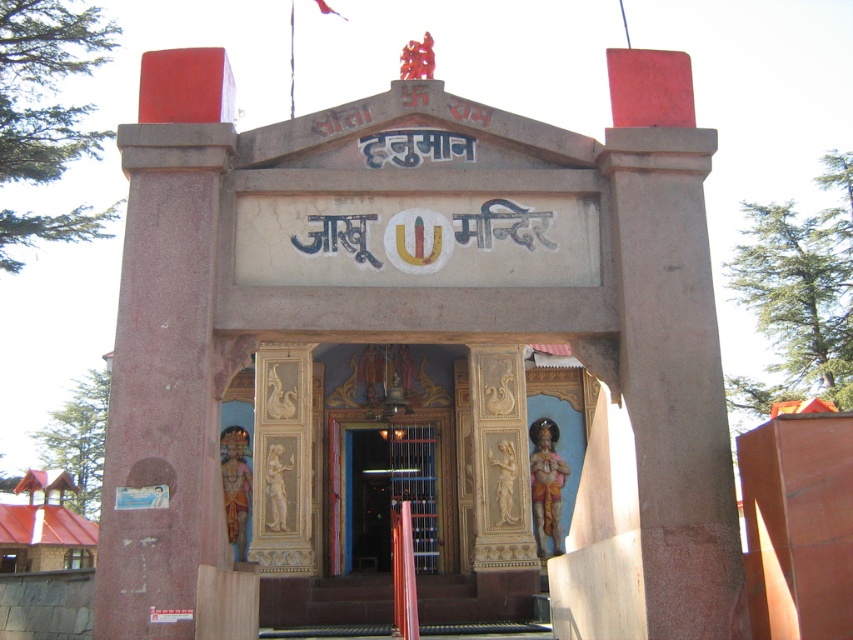
You are a visitor approaching the Jakhoo Mandir entrance. You notice the smooth stone hindu temple at center and the smooth stone stairs at center. Which structure appears broader in width from your viewpoint?

The smooth stone hindu temple at center might be wider than smooth stone stairs at center, so it likely appears broader in width from your viewpoint.

You are visiting the Jakhoo Mandir temple entrance and need to enter the temple. You see the smooth stone stairs at center and the wooden door at center. Which object is shorter in height?

The smooth stone stairs at center is not as tall as the wooden door at center, so the smooth stone stairs at center is shorter in height.